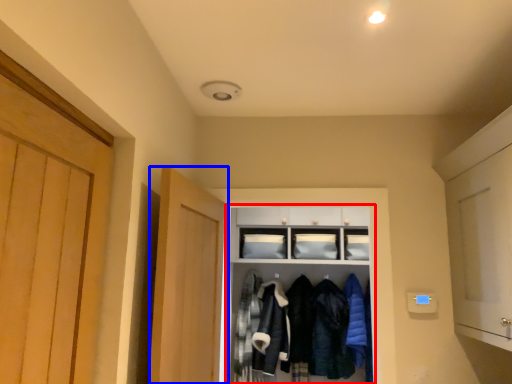
Question: Which object is further to the camera taking this photo, cabinetry (highlighted by a red box) or door (highlighted by a blue box)?

Choices:
 (A) cabinetry
 (B) door

Answer: (A)